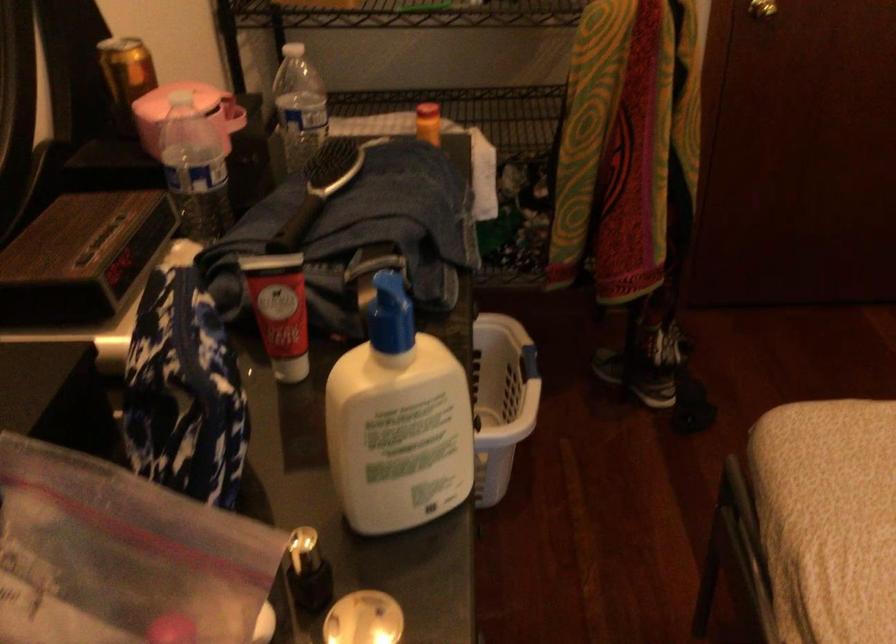
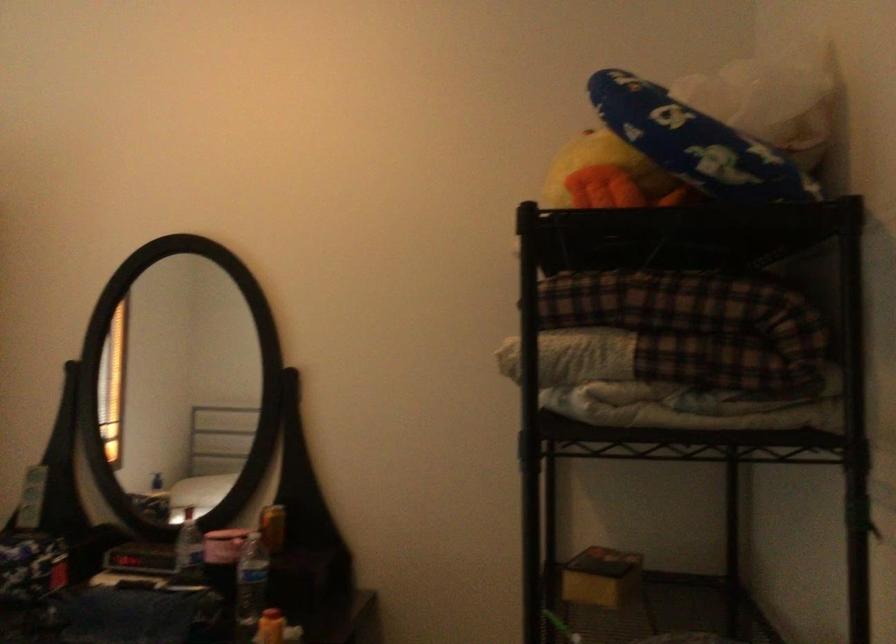
Locate, in the second image, the point that corresponds to (x=316, y=131) in the first image.

(250, 585)